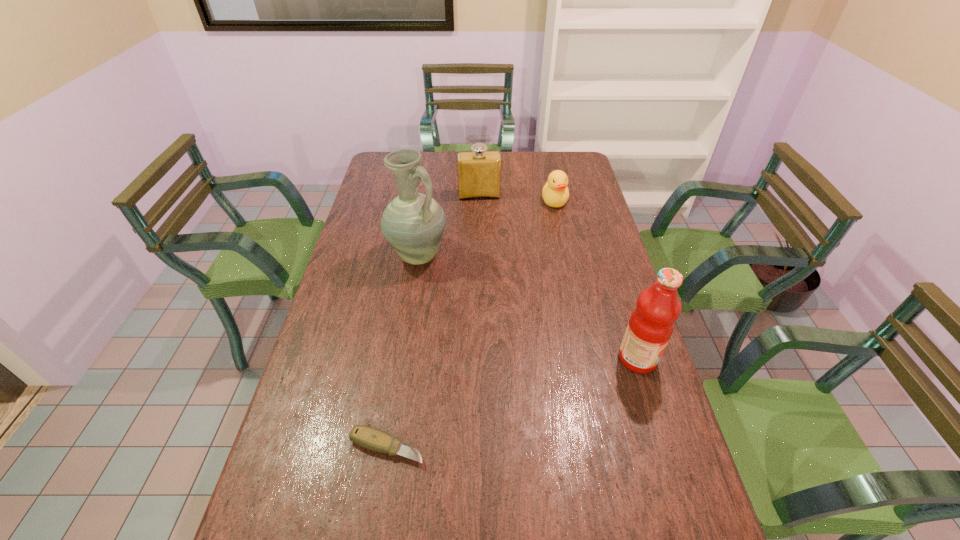
Identify the location of pocketknife located in the left edge section of the desktop. Image resolution: width=960 pixels, height=540 pixels. (370, 438).

You are a GUI agent. You are given a task and a screenshot of the screen. Output one action in this format:
    pyautogui.click(x=<x>, y=<y>)
    Task: Click on the pitcher at the left edge
    
    Given the screenshot: What is the action you would take?
    pyautogui.click(x=413, y=223)

The width and height of the screenshot is (960, 540). I want to click on fruit juice present at the right edge, so click(x=652, y=322).

In order to click on duck located in the right edge section of the desktop in this screenshot , I will do `click(555, 193)`.

You are a GUI agent. You are given a task and a screenshot of the screen. Output one action in this format:
    pyautogui.click(x=<x>, y=<y>)
    Task: Click on the vacant space at the far edge of the desktop
    
    Given the screenshot: What is the action you would take?
    pyautogui.click(x=446, y=164)

You are a GUI agent. You are given a task and a screenshot of the screen. Output one action in this format:
    pyautogui.click(x=<x>, y=<y>)
    Task: Click on the vacant space at the near edge of the desktop
    The height and width of the screenshot is (540, 960).
    Given the screenshot: What is the action you would take?
    pyautogui.click(x=444, y=529)

Find the location of a particular element. The height and width of the screenshot is (540, 960). vacant space at the left edge of the desktop is located at coordinates (291, 435).

The height and width of the screenshot is (540, 960). I want to click on vacant space at the right edge of the desktop, so click(x=666, y=430).

Where is `vacant space at the near left corner of the desktop`? The image size is (960, 540). vacant space at the near left corner of the desktop is located at coordinates (260, 504).

This screenshot has height=540, width=960. Find the location of `free space at the near right corner`. free space at the near right corner is located at coordinates (692, 536).